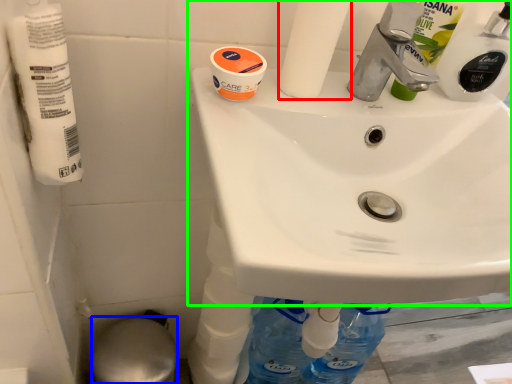
Question: Considering the real-world distances, which object is closest to toilet paper (highlighted by a red box)? bidet (highlighted by a blue box) or sink (highlighted by a green box).

Choices:
 (A) bidet
 (B) sink

Answer: (B)